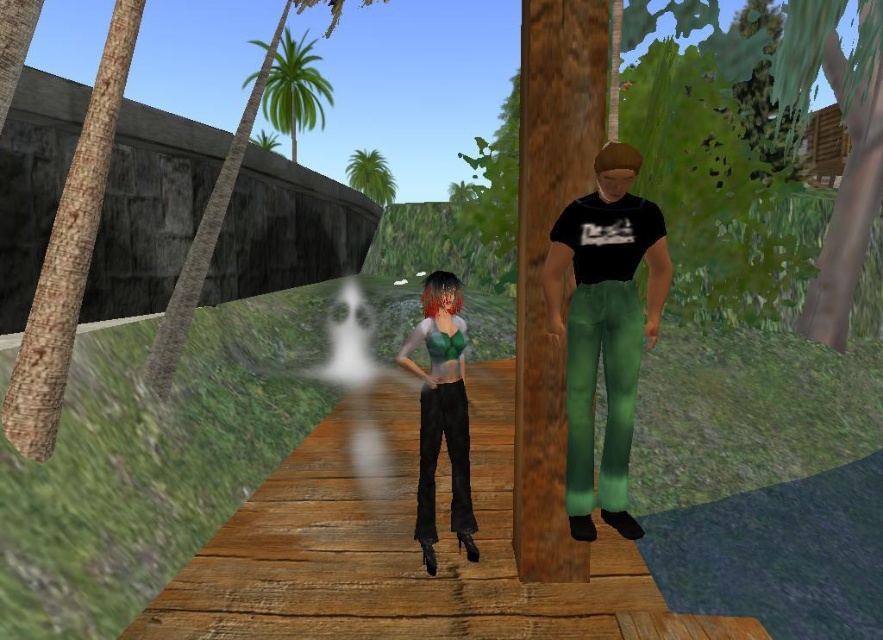
Is wooden plank at center to the left of green leafy palm tree at upper left from the viewer's perspective?

No, wooden plank at center is not to the left of green leafy palm tree at upper left.

Is wooden plank at center further to camera compared to green leafy palm tree at upper left?

No, wooden plank at center is in front of green leafy palm tree at upper left.

In the scene shown: Measure the distance between wooden plank at center and camera.

They are 3.92 meters apart.

I want to click on wooden plank at center, so coord(402,547).

Consider the image. Is wooden plank at center above green matte top at center?

No, wooden plank at center is not above green matte top at center.

Does point (489, 556) come in front of point (417, 330)?

No, (489, 556) is behind (417, 330).

What are the coordinates of `wooden plank at center` in the screenshot? It's located at (402, 547).

Does black matte shirt at center have a lesser height compared to green matte top at center?

No, black matte shirt at center is not shorter than green matte top at center.

How far apart are black matte shirt at center and green matte top at center?

black matte shirt at center is 3.66 feet away from green matte top at center.

I want to click on black matte shirt at center, so click(604, 326).